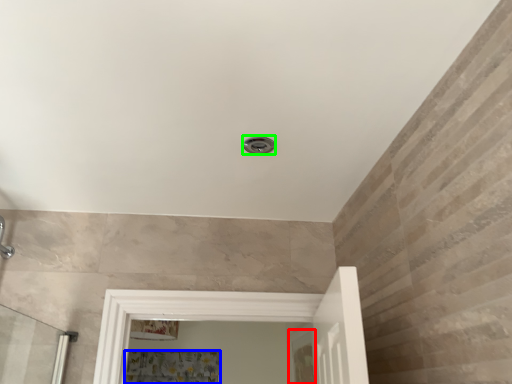
Question: Based on their relative distances, which object is nearer to screen door (highlighted by a red box)? Choose from shower curtain (highlighted by a blue box) and shower (highlighted by a green box).

Choices:
 (A) shower curtain
 (B) shower

Answer: (A)